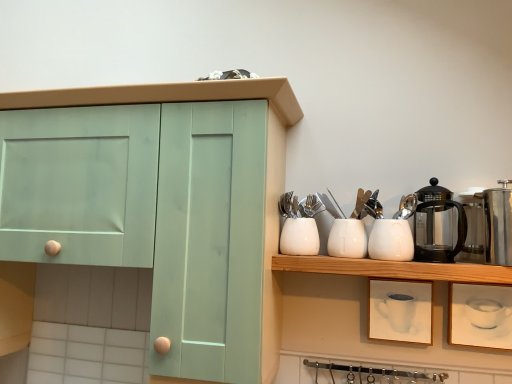
Question: Is white glossy vase at center, which ranks as the third tableware in right-to-left order, to the left of white glossy container at center, the 2th tableware in the left-to-right sequence, from the viewer's perspective?

Choices:
 (A) no
 (B) yes

Answer: (B)

Question: From a real-world perspective, is white glossy vase at center, the 1th tableware in the left-to-right sequence, physically above white glossy container at center, marked as the 2th tableware in a right-to-left arrangement?

Choices:
 (A) no
 (B) yes

Answer: (A)

Question: Can you confirm if white glossy vase at center, the 1th tableware in the left-to-right sequence, is smaller than white glossy container at center, marked as the 2th tableware in a right-to-left arrangement?

Choices:
 (A) no
 (B) yes

Answer: (B)

Question: Does white glossy vase at center, which ranks as the third tableware in right-to-left order, lie behind white glossy container at center, the 2th tableware in the left-to-right sequence?

Choices:
 (A) no
 (B) yes

Answer: (B)

Question: Is white glossy container at center, the 2th tableware in the left-to-right sequence, a part of white glossy vase at center, which ranks as the third tableware in right-to-left order?

Choices:
 (A) no
 (B) yes

Answer: (A)

Question: From the image's perspective, does white glossy vase at center, which ranks as the third tableware in right-to-left order, appear lower than white glossy container at center, marked as the 2th tableware in a right-to-left arrangement?

Choices:
 (A) no
 (B) yes

Answer: (A)

Question: Can you confirm if clear glass carafe at upper right, placed as the second appliance when sorted from left to right, is thinner than white glossy container at center, marked as the 2th tableware in a right-to-left arrangement?

Choices:
 (A) no
 (B) yes

Answer: (B)

Question: Considering the relative positions of clear glass carafe at upper right, placed as the second appliance when sorted from left to right, and white glossy container at center, marked as the 2th tableware in a right-to-left arrangement, in the image provided, is clear glass carafe at upper right, placed as the second appliance when sorted from left to right, to the right of white glossy container at center, marked as the 2th tableware in a right-to-left arrangement, from the viewer's perspective?

Choices:
 (A) yes
 (B) no

Answer: (A)

Question: Is clear glass carafe at upper right, the 2th appliance positioned from the right, closer to the viewer compared to white glossy container at center, the 2th tableware in the left-to-right sequence?

Choices:
 (A) no
 (B) yes

Answer: (B)

Question: Can we say clear glass carafe at upper right, the 2th appliance positioned from the right, lies outside white glossy container at center, marked as the 2th tableware in a right-to-left arrangement?

Choices:
 (A) yes
 (B) no

Answer: (A)

Question: Can you confirm if clear glass carafe at upper right, the 2th appliance positioned from the right, is bigger than white glossy container at center, the 2th tableware in the left-to-right sequence?

Choices:
 (A) yes
 (B) no

Answer: (B)

Question: From the image's perspective, is clear glass carafe at upper right, the 2th appliance positioned from the right, over white glossy container at center, marked as the 2th tableware in a right-to-left arrangement?

Choices:
 (A) yes
 (B) no

Answer: (A)

Question: Can you confirm if white glossy kettle at upper right, which is the 1th appliance in left-to-right order, is positioned to the right of black glass coffee pot at upper right?

Choices:
 (A) yes
 (B) no

Answer: (B)